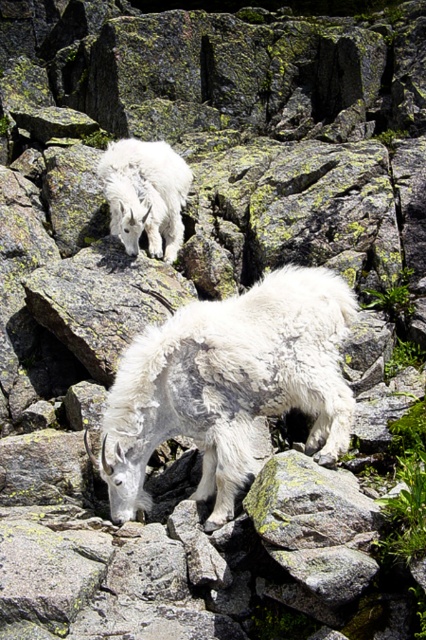
Question: Is white woolen goat at center positioned before white woolen goat at upper center?

Choices:
 (A) no
 (B) yes

Answer: (B)

Question: Which of the following is the closest to the observer?

Choices:
 (A) white woolen goat at upper center
 (B) white woolen goat at center

Answer: (B)

Question: Can you confirm if white woolen goat at center is positioned to the right of white woolen goat at upper center?

Choices:
 (A) no
 (B) yes

Answer: (B)

Question: Which point appears farthest from the camera in this image?

Choices:
 (A) (124, 205)
 (B) (178, 310)

Answer: (A)

Question: Which object appears closest to the camera in this image?

Choices:
 (A) white woolen goat at upper center
 (B) white woolen goat at center

Answer: (B)

Question: In this image, where is white woolen goat at center located relative to white woolen goat at upper center?

Choices:
 (A) right
 (B) left

Answer: (A)